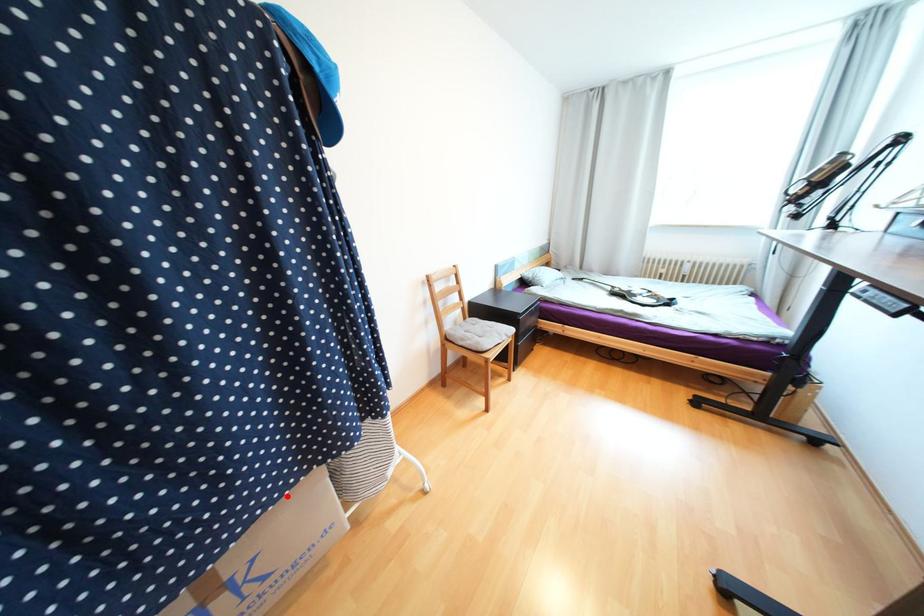
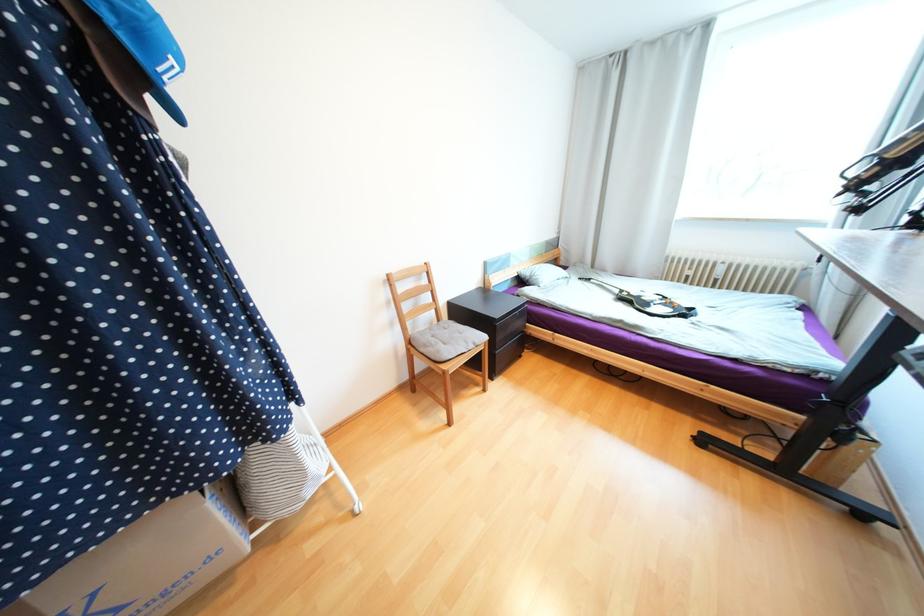
Locate, in the second image, the point that corresponds to the highlighted location in the first image.

(116, 535)